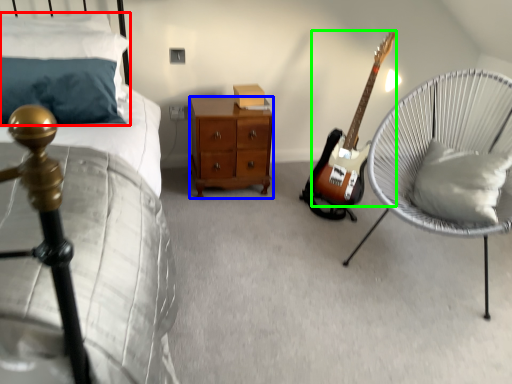
Question: Estimate the real-world distances between objects in this image. Which object is closer to pillow (highlighted by a red box), nightstand (highlighted by a blue box) or guitar (highlighted by a green box)?

Choices:
 (A) nightstand
 (B) guitar

Answer: (A)